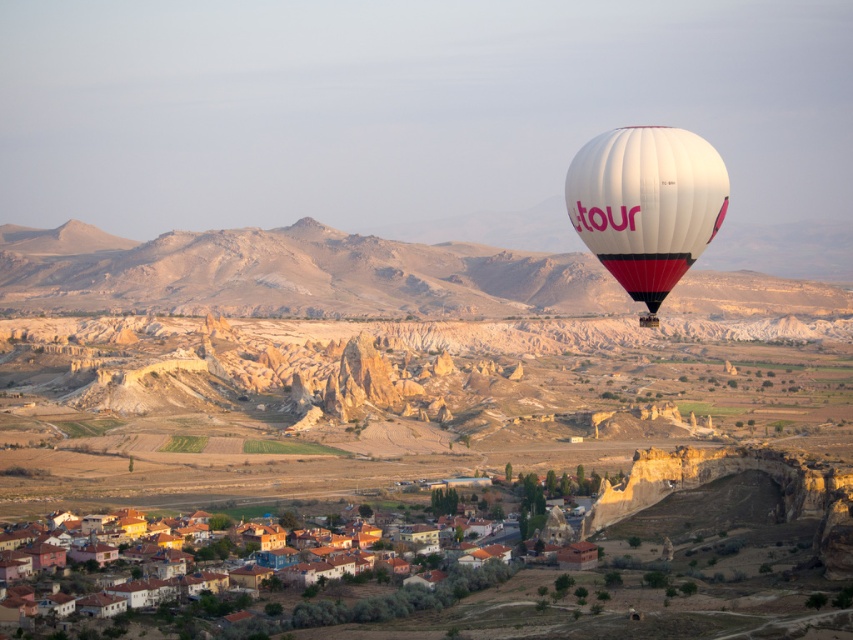
Question: Can you confirm if white fabric balloon at right is positioned above brown tiled roofs at lower center?

Choices:
 (A) yes
 (B) no

Answer: (A)

Question: Among these objects, which one is nearest to the camera?

Choices:
 (A) brown tiled roofs at lower center
 (B) white fabric balloon at right

Answer: (B)

Question: Can you confirm if white fabric balloon at right is thinner than brown tiled roofs at lower center?

Choices:
 (A) yes
 (B) no

Answer: (A)

Question: Does white fabric balloon at right appear under brown tiled roofs at lower center?

Choices:
 (A) no
 (B) yes

Answer: (A)